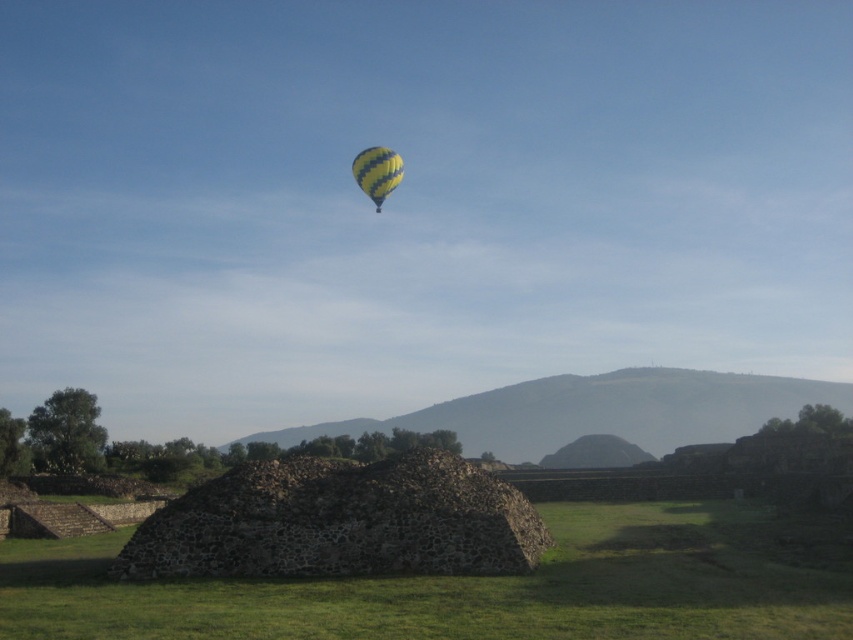
You are standing at the camera position and want to take a photo of the dark gray stone pyramid at center. If you walk 20 feet towards the pyramid, how far will you be from it?

The dark gray stone pyramid at center and camera are 78.89 feet apart. After walking 20 feet towards it, you will be 58.89 feet away from the dark gray stone pyramid at center.

You are standing on the grassy field in front of the dark gray stone pyramid at center and looking up at the yellow striped balloon at upper center. Which direction should you turn your head to see the balloon?

You should turn your head to the left because the dark gray stone pyramid at center is to the right of the yellow striped balloon at upper center, meaning the balloon is to the left of the pyramid.

You are a drone operator trying to capture a photo of the dark gray stone pyramid at center. Your drone is currently at the coordinates of point A, which is at the lower left corner of the image. To ensure the pyramid is centered in your shot, in which direction should you move the drone?

The dark gray stone pyramid at center is located at point (480, 586), so you should move the drone to the right and slightly upwards to center it in the shot.